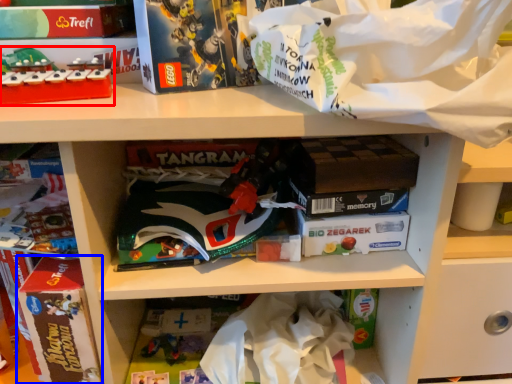
Question: Which point is further to the camera, toy (highlighted by a red box) or paperback book (highlighted by a blue box)?

Choices:
 (A) toy
 (B) paperback book

Answer: (B)